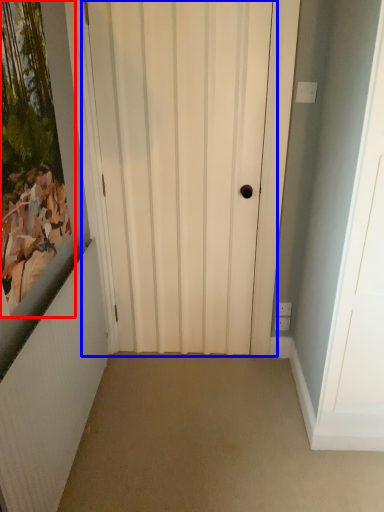
Question: Which object appears farthest to the camera in this image, picture frame (highlighted by a red box) or door (highlighted by a blue box)?

Choices:
 (A) picture frame
 (B) door

Answer: (B)